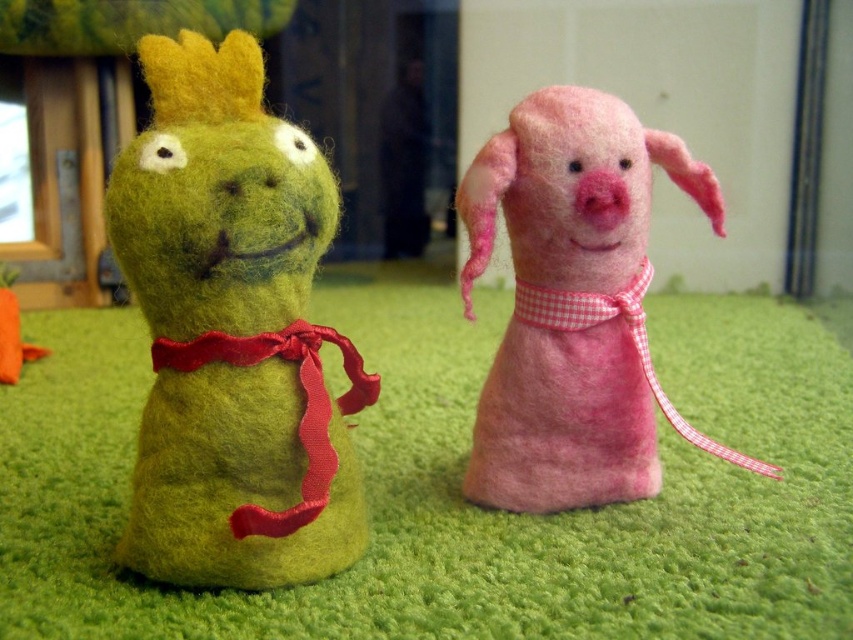
Question: Does pink felt piglet at center appear under pink felt apron at center?

Choices:
 (A) yes
 (B) no

Answer: (B)

Question: Does green felt frog at left have a larger size compared to pink felt piglet at center?

Choices:
 (A) no
 (B) yes

Answer: (A)

Question: Which point is closer to the camera?

Choices:
 (A) (639, 209)
 (B) (299, 556)

Answer: (B)

Question: Does pink felt piglet at center appear on the right side of pink felt apron at center?

Choices:
 (A) no
 (B) yes

Answer: (B)

Question: Which of the following is the closest to the observer?

Choices:
 (A) (267, 154)
 (B) (479, 208)
 (C) (538, 476)

Answer: (A)

Question: Which point is farther from the camera taking this photo?

Choices:
 (A) 508,483
 (B) 624,205
 (C) 837,387

Answer: (C)